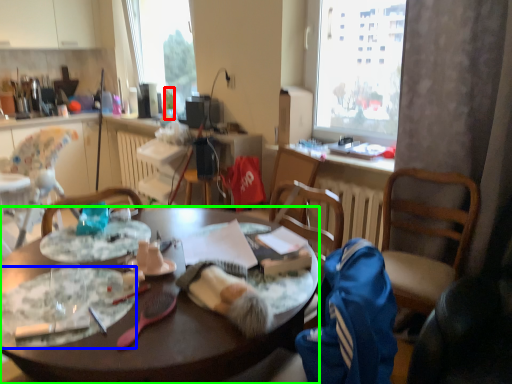
Question: Estimate the real-world distances between objects in this image. Which object is farther from bottle (highlighted by a red box), plate (highlighted by a blue box) or desk (highlighted by a green box)?

Choices:
 (A) plate
 (B) desk

Answer: (A)